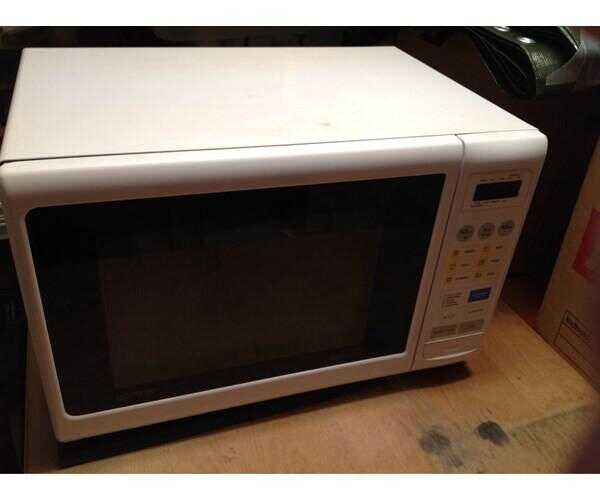
Find the location of `3 gray circles on microwave`. 3 gray circles on microwave is located at coordinates (467, 235), (482, 236), (514, 230).